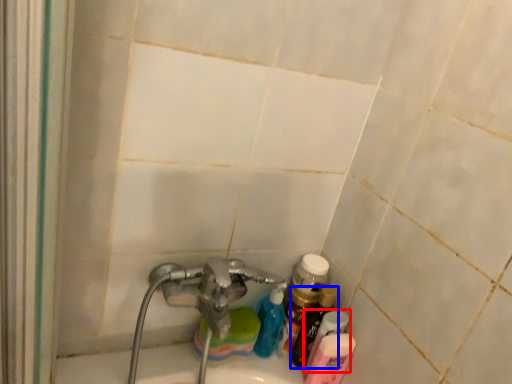
Question: Which object is closer to the camera taking this photo, toiletry (highlighted by a red box) or bottle (highlighted by a blue box)?

Choices:
 (A) toiletry
 (B) bottle

Answer: (A)